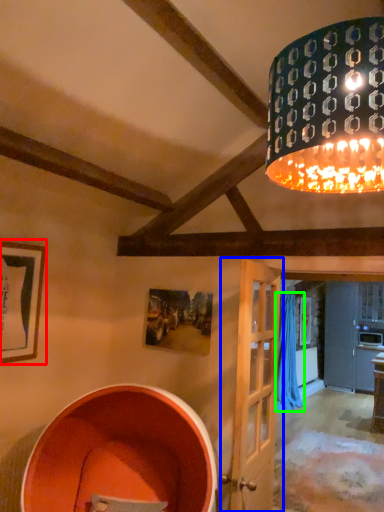
Question: Which object is positioned farthest from picture frame (highlighted by a red box)? Select from door (highlighted by a blue box) and curtain (highlighted by a green box).

Choices:
 (A) door
 (B) curtain

Answer: (B)